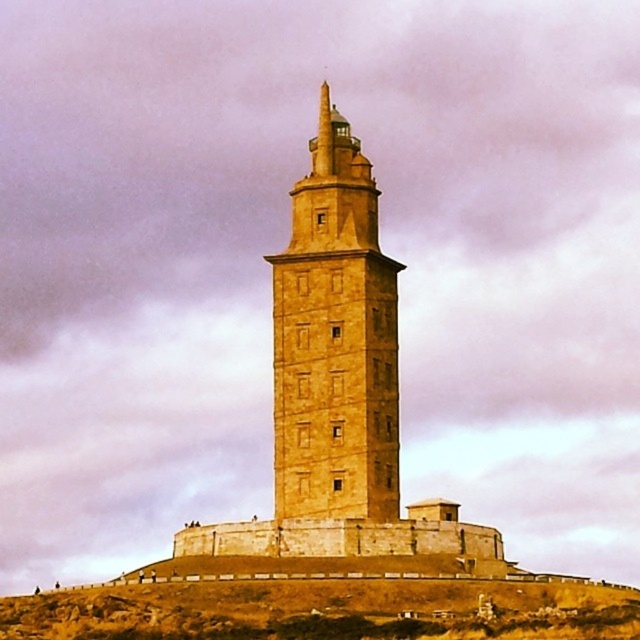
Is golden stone tower at center to the left of brown stone hillside at center from the viewer's perspective?

Incorrect, golden stone tower at center is not on the left side of brown stone hillside at center.

Identify the location of golden stone tower at center. The width and height of the screenshot is (640, 640). (333, 340).

Is point (387, 296) positioned before point (401, 632)?

No.

You are a GUI agent. You are given a task and a screenshot of the screen. Output one action in this format:
    pyautogui.click(x=<x>, y=<y>)
    Task: Click on the golden stone tower at center
    
    Given the screenshot: What is the action you would take?
    pyautogui.click(x=333, y=340)